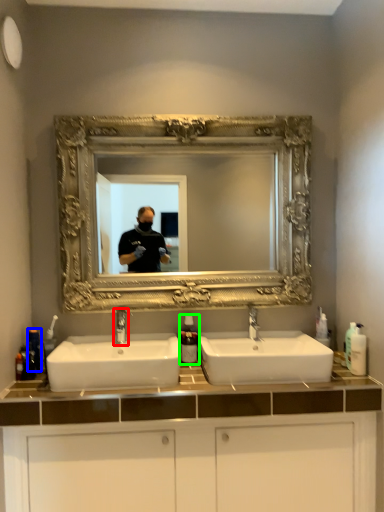
Question: Which object is positioned farthest from tap (highlighted by a red box)? Select from toiletry (highlighted by a blue box) and soap dispenser (highlighted by a green box).

Choices:
 (A) toiletry
 (B) soap dispenser

Answer: (A)